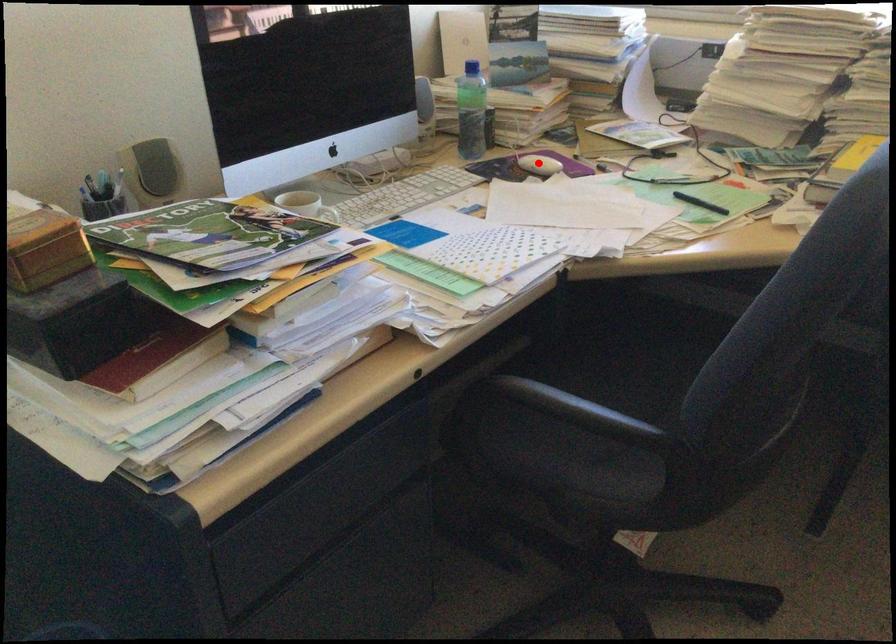
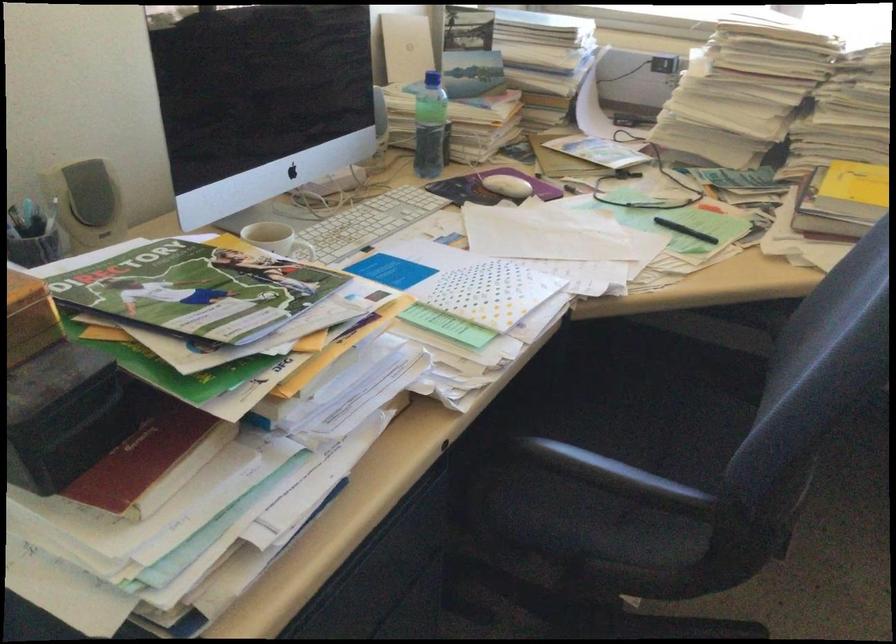
Find the pixel in the second image that matches the highlighted location in the first image.

(506, 185)